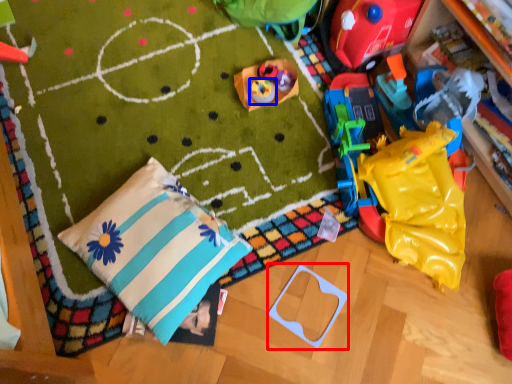
Question: Which object appears farthest to the camera in this image, toy (highlighted by a red box) or toy (highlighted by a blue box)?

Choices:
 (A) toy
 (B) toy

Answer: (B)